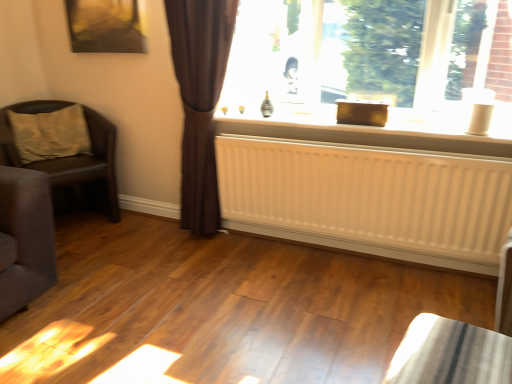
Question: Relative to beige fabric pillow at left, is shiny metallic table at lower right in front or behind?

Choices:
 (A) front
 (B) behind

Answer: (A)

Question: Is shiny metallic table at lower right spatially inside beige fabric pillow at left, or outside of it?

Choices:
 (A) outside
 (B) inside

Answer: (A)

Question: Based on their relative distances, which object is farther from the beige fabric pillow at left?

Choices:
 (A) metallic gold picture frame at upper left
 (B) brown sheer curtain at left
 (C) shiny metallic table at lower right
 (D) brown leather chair at left
 (E) white matte radiator at center

Answer: (C)

Question: Estimate the real-world distances between objects in this image. Which object is closer to the brown leather chair at left?

Choices:
 (A) metallic gold picture frame at upper left
 (B) white plastic window sill at center
 (C) white matte radiator at center
 (D) beige fabric pillow at left
 (E) brown sheer curtain at left

Answer: (D)